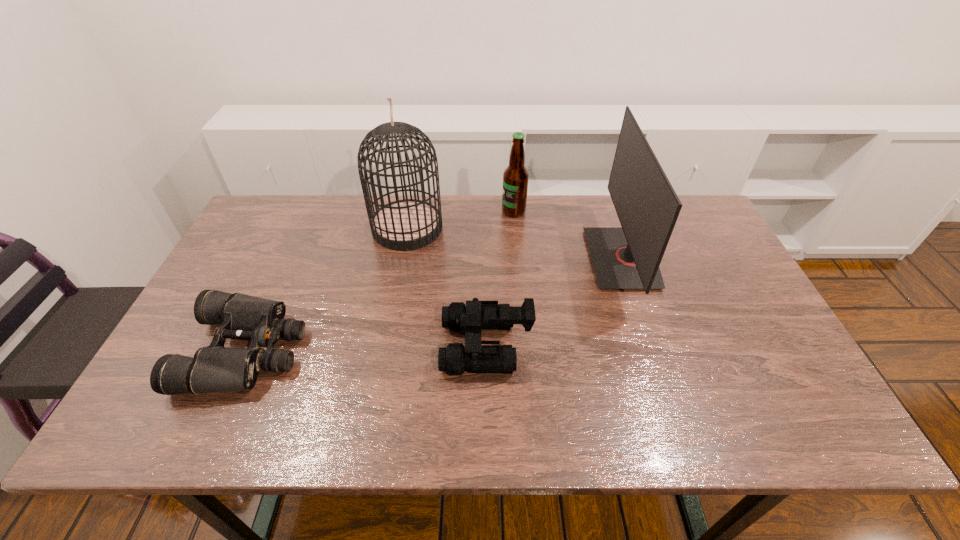
At what (x,y) coordinates should I click in order to perform the action: click on free space located on the screen side of the rightmost object. Please return your answer as a coordinate pair (x, y). Looking at the image, I should click on (556, 259).

At what (x,y) coordinates should I click in order to perform the action: click on free space located 0.270m on the screen side of the rightmost object. Please return your answer as a coordinate pair (x, y). The height and width of the screenshot is (540, 960). Looking at the image, I should click on (499, 259).

Identify the location of blank area located on the label of the beer bottle. The height and width of the screenshot is (540, 960). (385, 211).

Where is `vacant space situated on the label of the beer bottle`? The height and width of the screenshot is (540, 960). vacant space situated on the label of the beer bottle is located at coordinates (403, 211).

This screenshot has width=960, height=540. I want to click on vacant space located 0.180m on the label of the beer bottle, so click(x=447, y=211).

Where is `vacant position located on the front lenses of the taller binoculars`? The image size is (960, 540). vacant position located on the front lenses of the taller binoculars is located at coordinates (336, 346).

I want to click on blank space located 0.280m on the front lenses of the taller binoculars, so click(x=328, y=346).

The height and width of the screenshot is (540, 960). I want to click on vacant area situated 0.260m on the front lenses of the taller binoculars, so click(x=336, y=346).

Image resolution: width=960 pixels, height=540 pixels. Identify the location of free location located through the eyepieces of the shorter binoculars. point(448,350).

The height and width of the screenshot is (540, 960). In order to click on birdcage positioned at the far edge in this screenshot , I will do `click(402, 225)`.